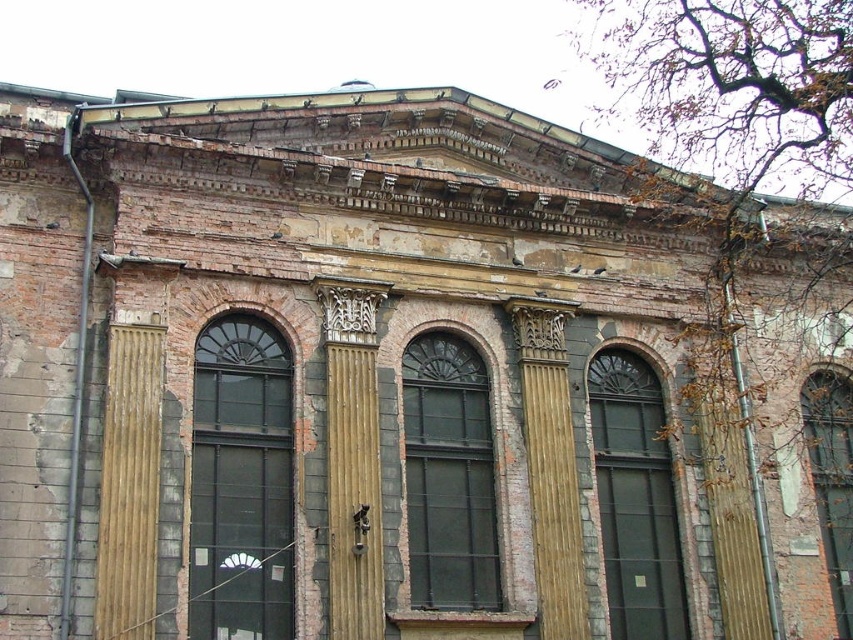
Question: Which object is farther from the camera taking this photo?

Choices:
 (A) dark gray glass window at right
 (B) matte glass window at center
 (C) wooden column at left

Answer: (A)

Question: Among these points, which one is farthest from the camera?

Choices:
 (A) (141, 381)
 (B) (556, 387)
 (C) (282, 570)
 (D) (459, 561)

Answer: (B)

Question: In this image, where is wooden column at left located relative to wooden carved column at center?

Choices:
 (A) left
 (B) right

Answer: (A)

Question: Which is nearer to the wooden carved column at center?

Choices:
 (A) dark gray glass window at center
 (B) dark gray glass window at center left
 (C) matte glass window at center

Answer: (C)

Question: Is the position of matte glass window at center less distant than that of wooden column at left?

Choices:
 (A) yes
 (B) no

Answer: (B)

Question: Does wooden column at left appear over dark gray glass window at right?

Choices:
 (A) yes
 (B) no

Answer: (A)